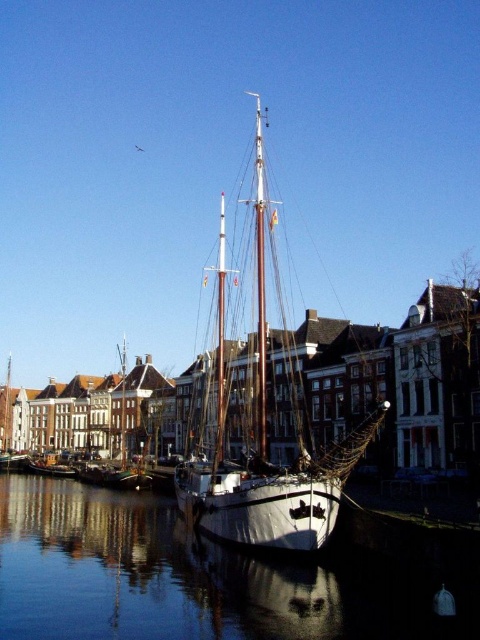
Question: Is the position of glossy water at center more distant than that of white matte sailboat at center?

Choices:
 (A) yes
 (B) no

Answer: (B)

Question: Can you confirm if glossy water at center is positioned to the left of white matte sailboat at center?

Choices:
 (A) no
 (B) yes

Answer: (B)

Question: Among these objects, which one is nearest to the camera?

Choices:
 (A) glossy water at center
 (B) white matte sailboat at center

Answer: (A)

Question: Does glossy water at center have a larger size compared to white matte sailboat at center?

Choices:
 (A) yes
 (B) no

Answer: (B)

Question: Which point is farther to the camera?

Choices:
 (A) (264, 541)
 (B) (309, 582)

Answer: (A)

Question: Which point is farther to the camera?

Choices:
 (A) (35, 481)
 (B) (303, 529)

Answer: (A)